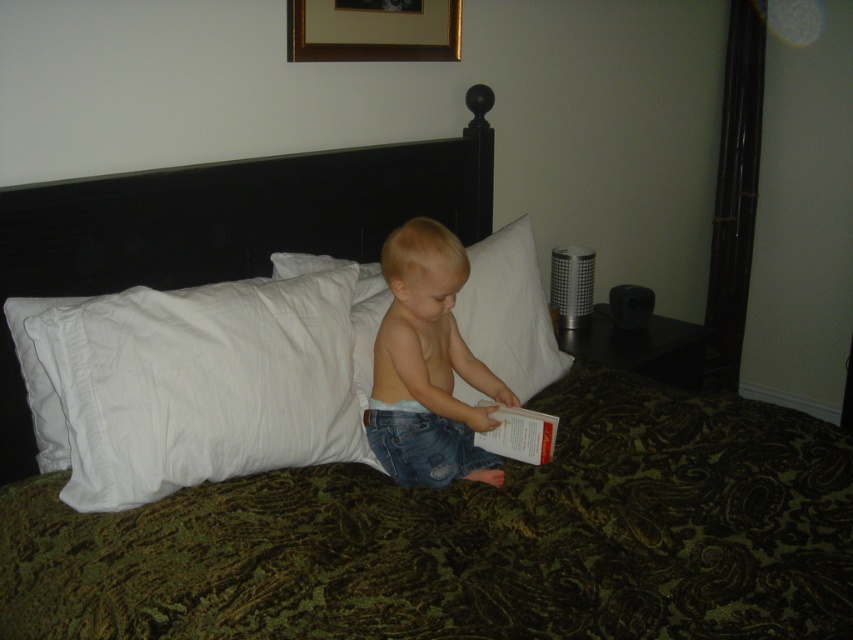
Question: Which point is closer to the camera?

Choices:
 (A) denim shorts at center
 (B) gold wooden picture frame at upper center

Answer: (A)

Question: Is the position of white cotton pillow at left more distant than that of denim shorts at center?

Choices:
 (A) yes
 (B) no

Answer: (B)

Question: Which point is closer to the camera?

Choices:
 (A) (521, 365)
 (B) (427, 289)

Answer: (B)

Question: Observing the image, what is the correct spatial positioning of white cotton pillow at left in reference to denim shorts at center?

Choices:
 (A) above
 (B) below

Answer: (B)

Question: Is denim shorts at center closer to camera compared to white paper at center?

Choices:
 (A) yes
 (B) no

Answer: (A)

Question: Which of the following is the closest to the observer?

Choices:
 (A) white soft pillow at center
 (B) white paper at center
 (C) denim shorts at center
 (D) white cotton pillow at left

Answer: (D)